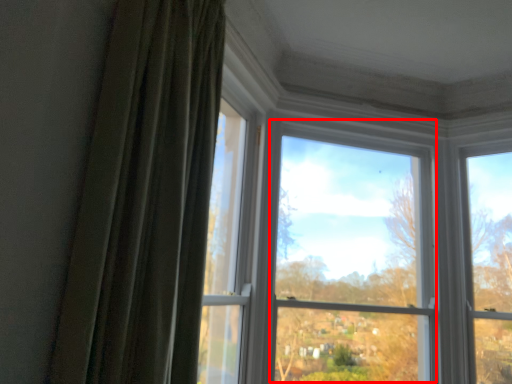
Question: From the image's perspective, where is bay window (annotated by the red box) located relative to curtain?

Choices:
 (A) below
 (B) above

Answer: (A)